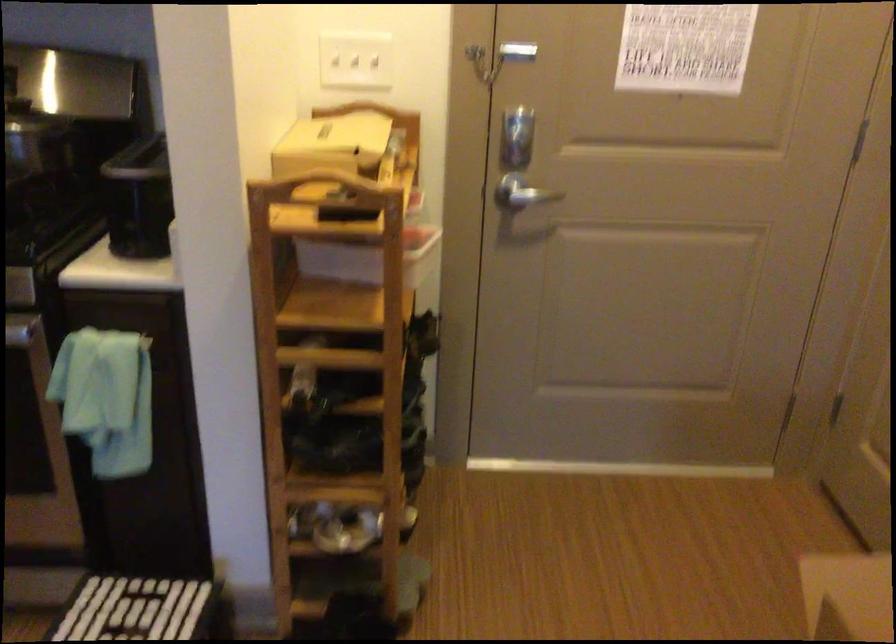
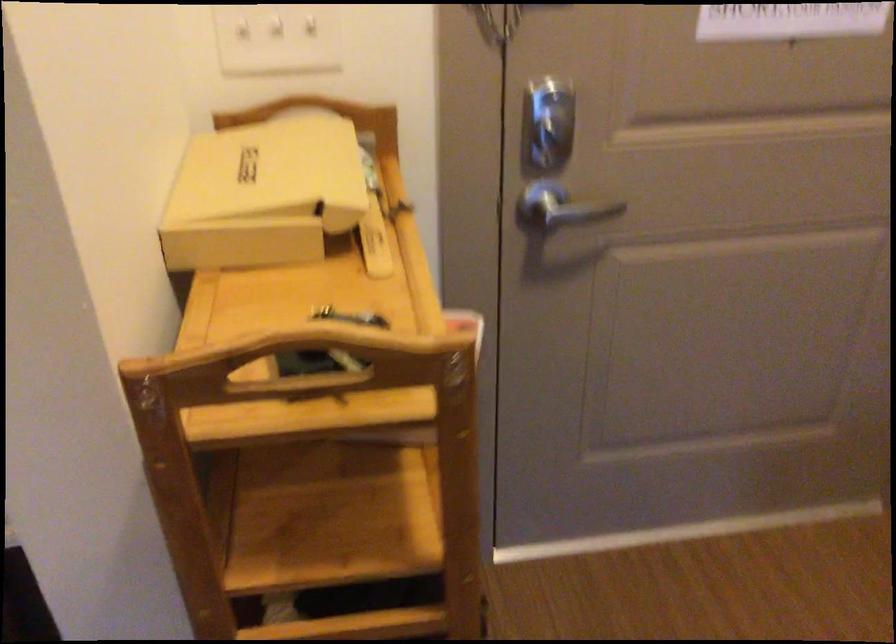
Locate, in the second image, the point that corresponds to point (331, 140) in the first image.

(263, 194)